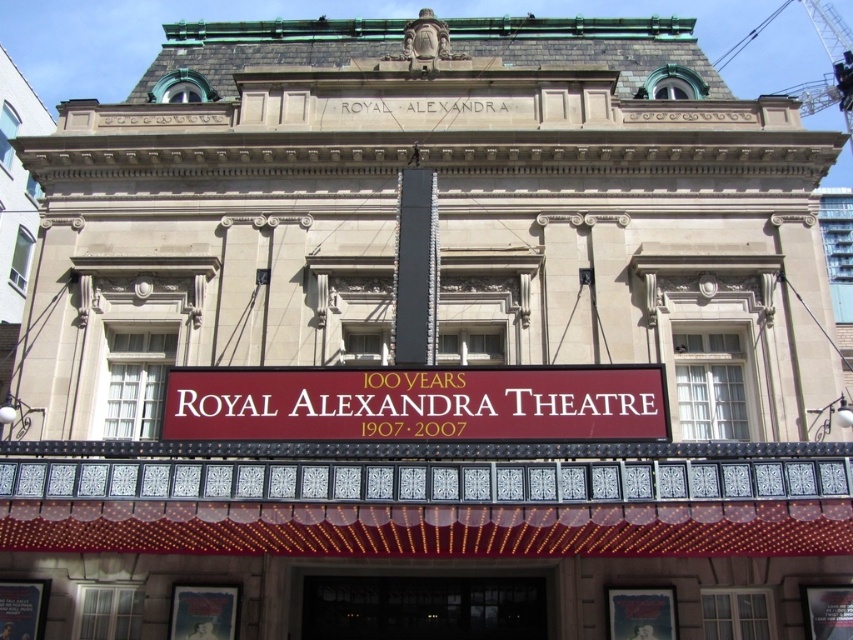
Question: Is maroon sign at center wider than black glass door at center?

Choices:
 (A) no
 (B) yes

Answer: (B)

Question: Which of the following is the farthest from the observer?

Choices:
 (A) (608, 424)
 (B) (450, 620)

Answer: (B)

Question: Can you confirm if maroon sign at center is smaller than black glass door at center?

Choices:
 (A) no
 (B) yes

Answer: (A)

Question: Which of the following is the farthest from the observer?

Choices:
 (A) black glass door at center
 (B) maroon sign at center

Answer: (A)

Question: Which of the following is the closest to the observer?

Choices:
 (A) black glass door at center
 (B) maroon sign at center

Answer: (B)

Question: Is maroon sign at center closer to camera compared to black glass door at center?

Choices:
 (A) yes
 (B) no

Answer: (A)